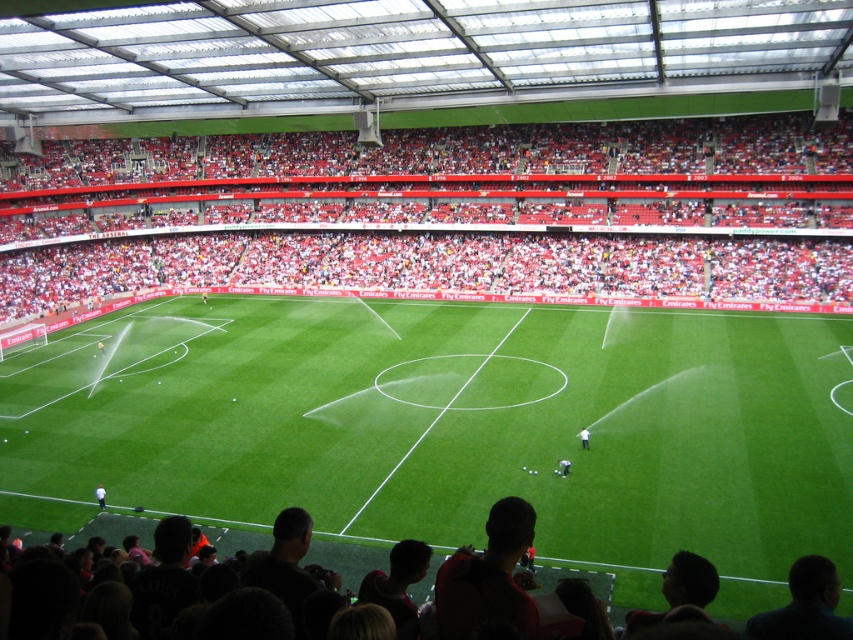
Question: Can you confirm if green grass football field at center is smaller than white fabric person at lower left?

Choices:
 (A) no
 (B) yes

Answer: (A)

Question: Estimate the real-world distances between objects in this image. Which object is closer to the green grass football field at center?

Choices:
 (A) red plastic seats at upper center
 (B) dark blue jersey at center

Answer: (B)

Question: Can you confirm if green grass football field at center is thinner than white matte person at center?

Choices:
 (A) no
 (B) yes

Answer: (A)

Question: Which of the following is the closest to the observer?

Choices:
 (A) (202, 525)
 (B) (566, 470)

Answer: (A)

Question: Which of the following is the closest to the observer?

Choices:
 (A) (579, 438)
 (B) (345, 220)
 (C) (621, 614)

Answer: (C)

Question: Considering the relative positions of red plastic seats at upper center and dark red shirt at lower center in the image provided, where is red plastic seats at upper center located with respect to dark red shirt at lower center?

Choices:
 (A) right
 (B) left

Answer: (B)